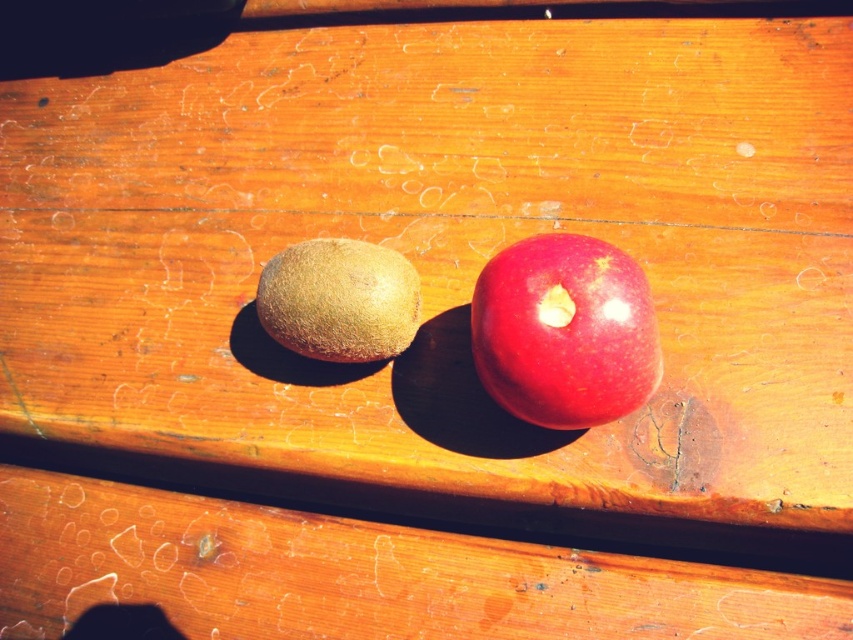
Can you confirm if glossy red apple at center is positioned below brown fuzzy kiwi at center?

Yes, glossy red apple at center is below brown fuzzy kiwi at center.

This screenshot has width=853, height=640. I want to click on glossy red apple at center, so pyautogui.click(x=564, y=332).